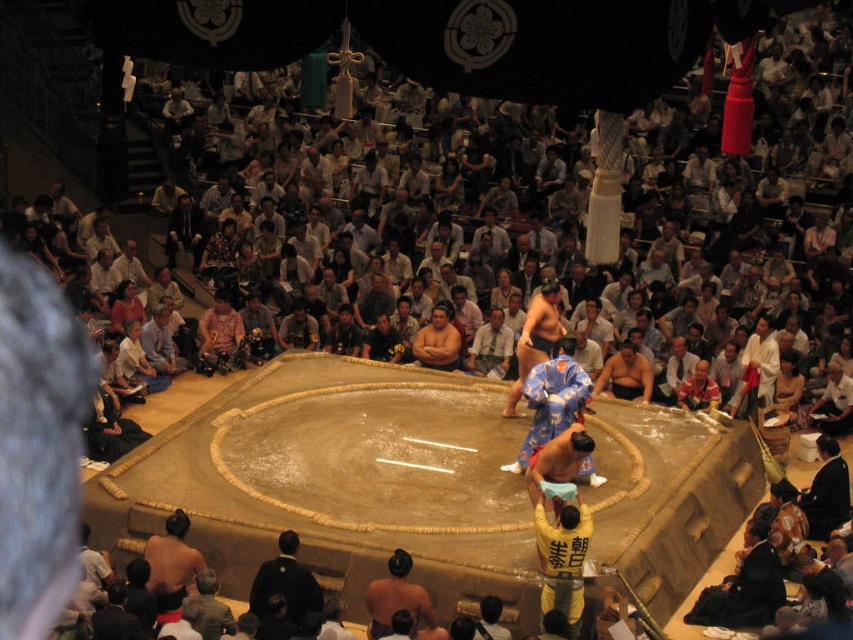
You are a photographer standing in the arena and want to take a closeup shot of the point at coordinates [393,554]. Given that your camera has a maximum zoom range of 50 feet, can you capture the point clearly?

The point at coordinates [393,554] is 65.23 feet away from the viewer, which exceeds the camera maximum zoom range of 50 feet. Therefore, the photographer cannot capture the point clearly.

Looking at this image, you are a photographer positioned at the back of the arena. You want to take a photo of the brown skin sumo at lower left and the black silk kimono at lower right. Considering their sizes, which object should you zoom in more on to ensure both are clearly visible in the frame?

The brown skin sumo at lower left is wider than the black silk kimono at lower right. To ensure both are clearly visible, you should zoom in more on the brown skin sumo at lower left since it is wider and requires more space in the frame.

You are a photographer standing at the center of the arena. You need to take a photo of the black silk kimono at lower right. Which direction should you move to get a clear shot of it?

The black silk kimono at lower right is located at point 0.769 on the x axis and 0.970 on the y axis. Since you are at the center, you should move towards the lower right direction to capture it clearly.